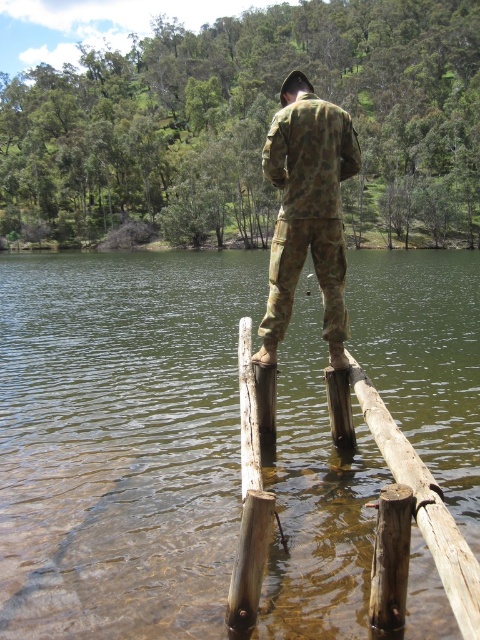
Question: Does brown wooden rail at center lie in front of brown wood pole at center?

Choices:
 (A) no
 (B) yes

Answer: (B)

Question: Among these objects, which one is nearest to the camera?

Choices:
 (A) clear water at post center
 (B) brown wood pole at center
 (C) camouflage fabric pants at center

Answer: (B)

Question: Which of the following is the farthest from the observer?

Choices:
 (A) brown wood pole at center
 (B) brown wooden rail at center
 (C) clear water at post center
 (D) camouflage fabric pants at center

Answer: (D)

Question: Does camouflage fabric pants at center have a smaller size compared to brown wood pole at center?

Choices:
 (A) yes
 (B) no

Answer: (B)

Question: Which object is positioned farthest from the clear water at post center?

Choices:
 (A) camouflage fabric pants at center
 (B) brown wood pole at center
 (C) brown wooden rail at center

Answer: (B)

Question: Does camouflage fabric pants at center appear on the left side of brown wooden rail at center?

Choices:
 (A) yes
 (B) no

Answer: (A)